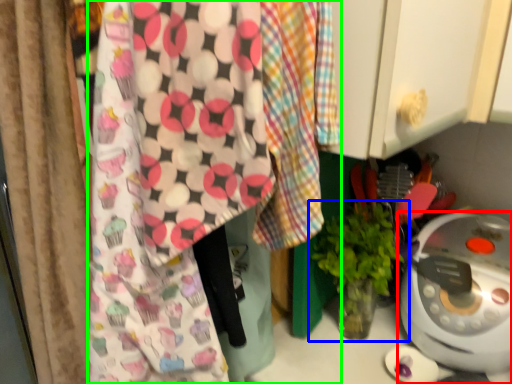
Question: Estimate the real-world distances between objects in this image. Which object is farther from home appliance (highlighted by a red box), houseplant (highlighted by a blue box) or wrapping paper (highlighted by a green box)?

Choices:
 (A) houseplant
 (B) wrapping paper

Answer: (B)